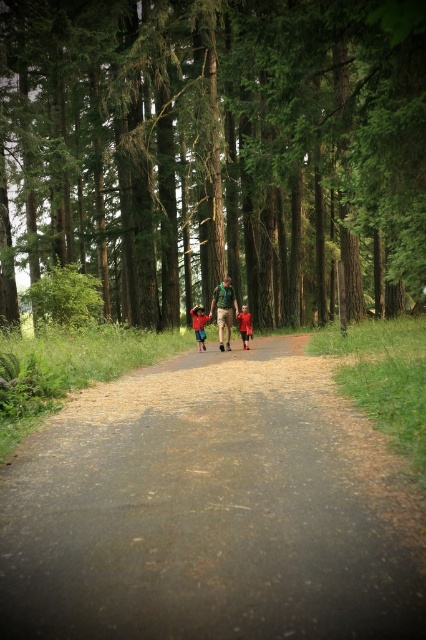
Which is above, dirt road at center or red velvet coat at center?

red velvet coat at center is higher up.

Is dirt road at center in front of red velvet coat at center?

Yes, it is in front of red velvet coat at center.

Which is behind, point (261, 378) or point (238, 314)?

Point (238, 314)

I want to click on dirt road at center, so pos(212,509).

Is red fabric shirt at center below red velvet coat at center?

Yes, red fabric shirt at center is below red velvet coat at center.

Is red fabric shirt at center behind red velvet coat at center?

Yes, red fabric shirt at center is behind red velvet coat at center.

Measure the distance between point [201,323] and camera.

21.12 meters

Identify the location of red fabric shirt at center. Image resolution: width=426 pixels, height=640 pixels. (199, 324).

Is green fabric shirt at center to the left of red fabric shirt at center from the viewer's perspective?

Incorrect, green fabric shirt at center is not on the left side of red fabric shirt at center.

Is green fabric shirt at center positioned in front of red fabric shirt at center?

Yes, green fabric shirt at center is in front of red fabric shirt at center.

Does point (224, 285) come in front of point (201, 307)?

Yes, it is in front of point (201, 307).

Where is `green fabric shirt at center`? This screenshot has height=640, width=426. green fabric shirt at center is located at coordinates (224, 310).